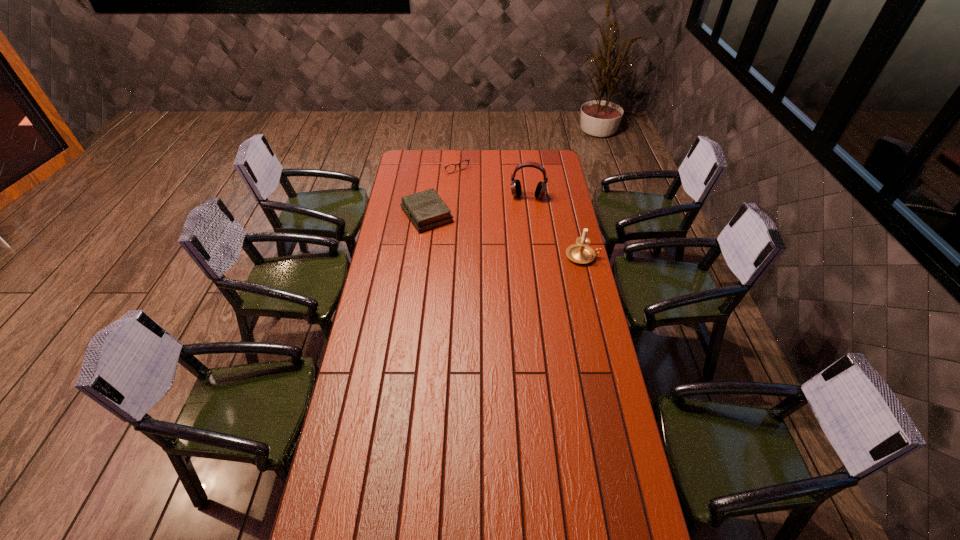
You are a GUI agent. You are given a task and a screenshot of the screen. Output one action in this format:
    pyautogui.click(x=<x>, y=<y>)
    Task: Click on the free space on the desktop that is between the book and the third shortest object and is positioned on the ear pads of the headset
    Image resolution: width=960 pixels, height=540 pixels.
    Given the screenshot: What is the action you would take?
    pyautogui.click(x=522, y=240)

Locate an element on the screen. This screenshot has width=960, height=540. vacant space on the desktop that is between the book and the second tallest object and is positioned through the lenses of the shortest object is located at coordinates (524, 240).